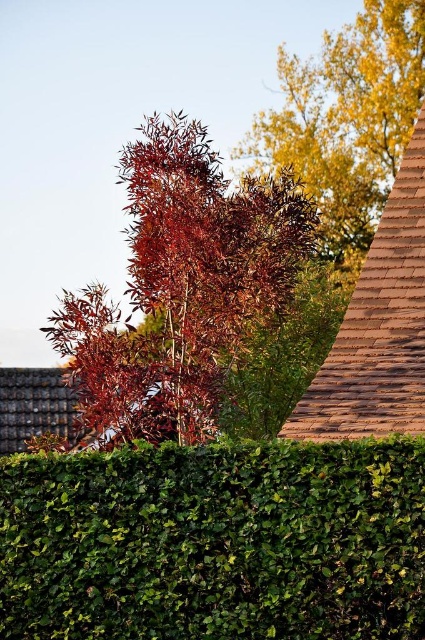
From the picture: You are a gardener planning to trim the green leafy hedge at center and the golden yellow leaves at upper right. Which object should you tackle first based on their positions in the scene?

You should trim the green leafy hedge at center first because it is in front of the golden yellow leaves at upper right, making it more accessible.

You are designing a garden layout and want to place a small statue between the green leafy hedge at center and the glossy red autumn tree at center. Based on their sizes, which object should the statue be closer to?

The green leafy hedge at center is larger than the glossy red autumn tree at center, so the statue should be placed closer to the glossy red autumn tree at center to balance the visual weight.

You are standing in the garden and see the green leafy hedge at center and the glossy red autumn tree at center. Which object is located to the right of the other?

The green leafy hedge at center is positioned on the right side of glossy red autumn tree at center, so the green leafy hedge at center is to the right of the glossy red autumn tree at center.